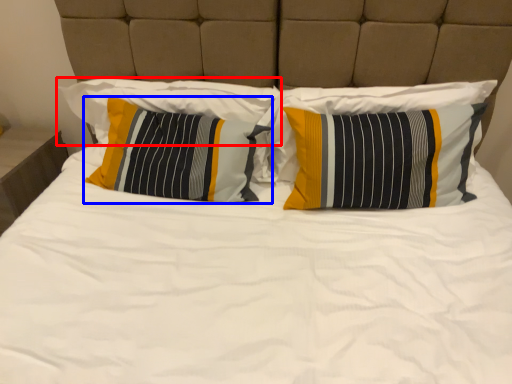
Question: Among these objects, which one is farthest to the camera, pillow (highlighted by a red box) or pillow (highlighted by a blue box)?

Choices:
 (A) pillow
 (B) pillow

Answer: (A)